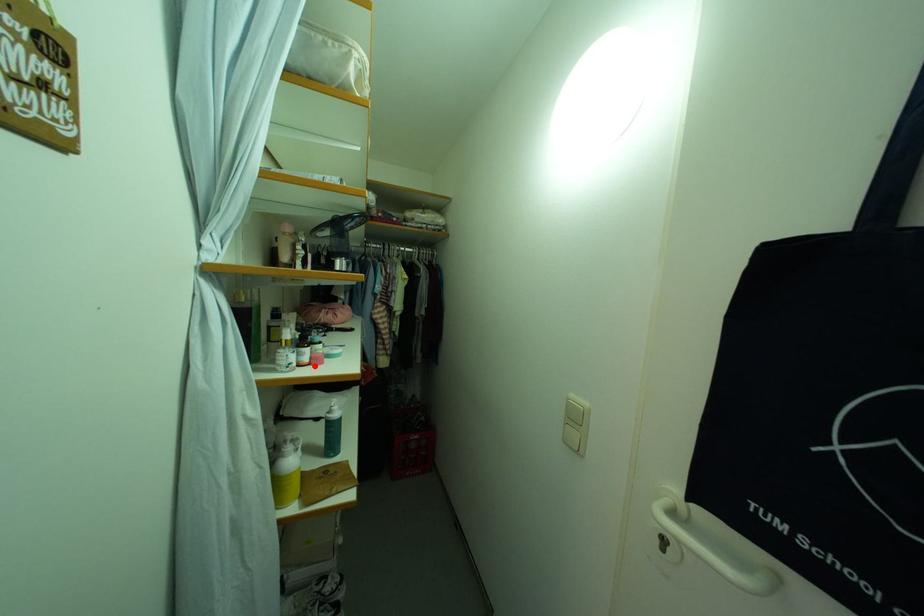
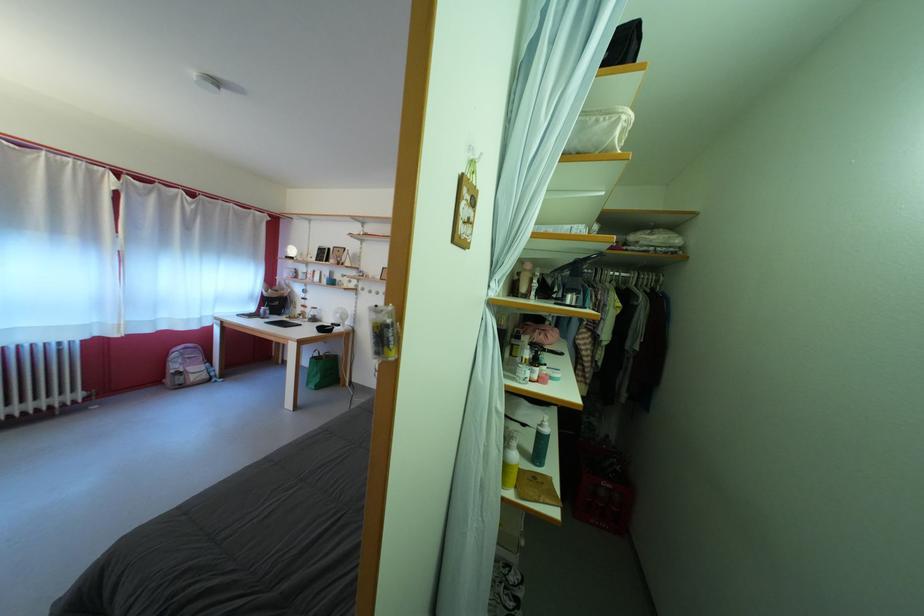
The point at the highlighted location is marked in the first image. Where is the corresponding point in the second image?

(543, 383)